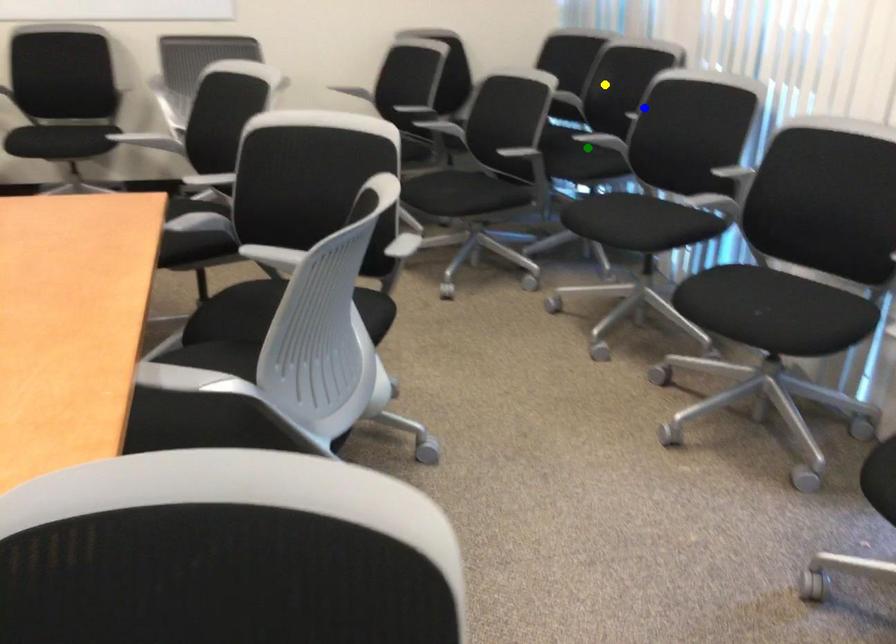
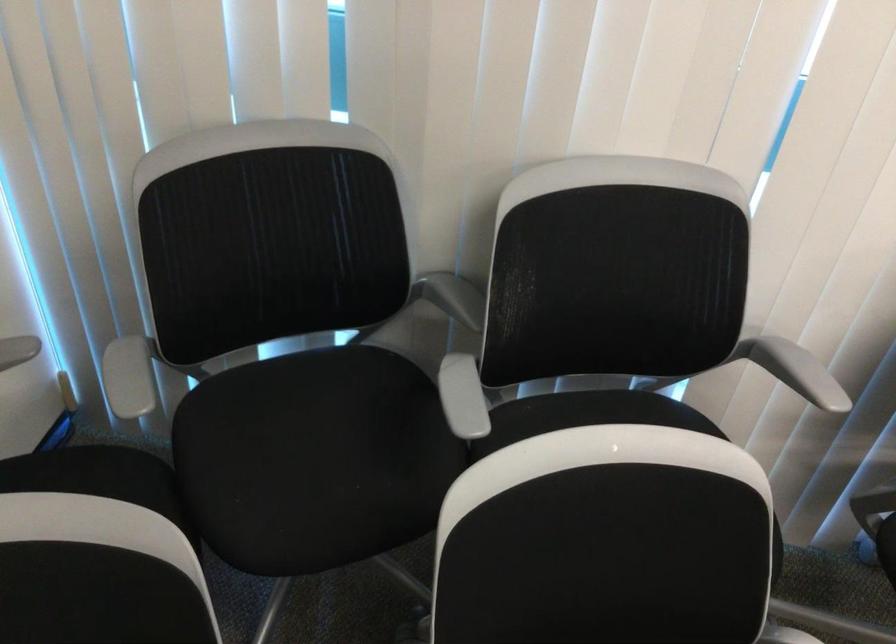
I am providing you with two images of the same scene from different viewpoints. Three points are marked in image1. Which point corresponds to a part or object that is occluded in image2?In image1, three points are marked. Which of them correspond to a part or object that is occluded in image2?Among the three points shown in image1, which one corresponds to a part or object that is no longer visible due to occlusion in image2?

green point